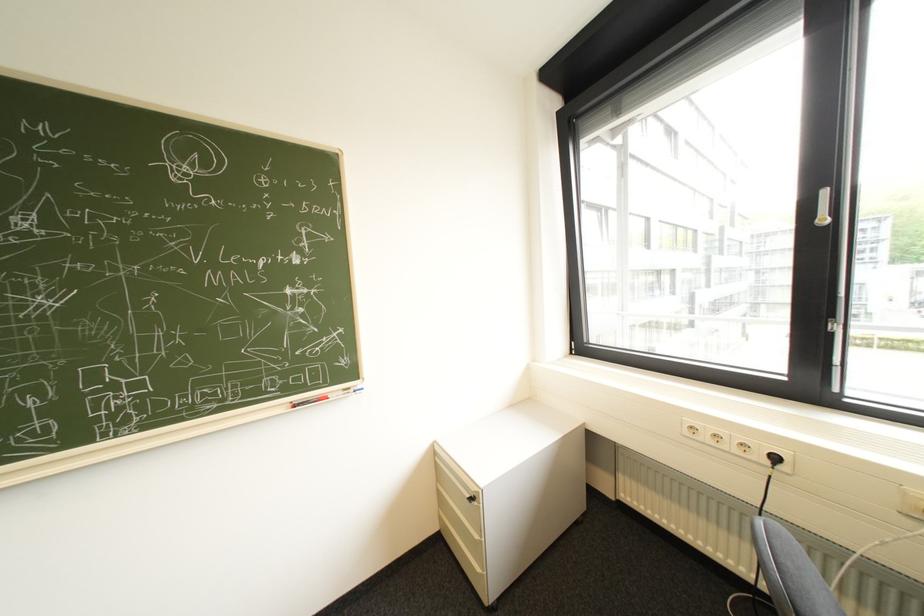
The image size is (924, 616). In order to click on black power plug in this screenshot , I will do `click(773, 459)`.